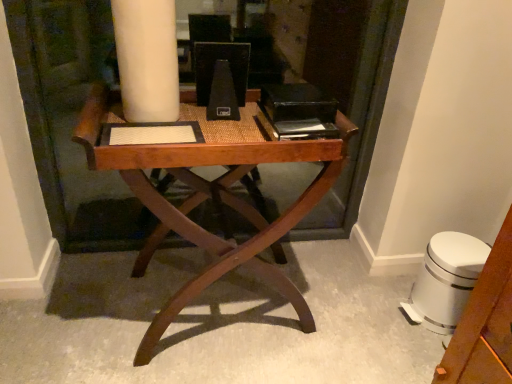
Question: Is wooden desk at center situated inside white plastic swivel chair at lower right or outside?

Choices:
 (A) inside
 (B) outside

Answer: (B)

Question: Considering their positions, is wooden desk at center located in front of or behind white plastic swivel chair at lower right?

Choices:
 (A) behind
 (B) front

Answer: (B)

Question: Looking at their shapes, would you say wooden desk at center is wider or thinner than white plastic swivel chair at lower right?

Choices:
 (A) wide
 (B) thin

Answer: (A)

Question: Choose the correct answer: Is white plastic swivel chair at lower right inside wooden desk at center or outside it?

Choices:
 (A) inside
 (B) outside

Answer: (B)

Question: Is white plastic swivel chair at lower right in front of or behind wooden desk at center in the image?

Choices:
 (A) front
 (B) behind

Answer: (B)

Question: Considering the positions of point (409, 311) and point (154, 331), is point (409, 311) closer or farther from the camera than point (154, 331)?

Choices:
 (A) closer
 (B) farther

Answer: (B)

Question: Is white plastic swivel chair at lower right wider or thinner than wooden desk at center?

Choices:
 (A) wide
 (B) thin

Answer: (B)